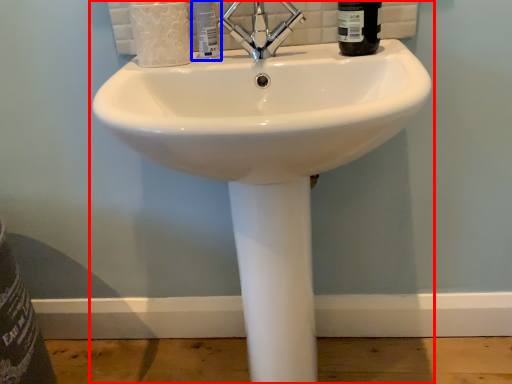
Question: Which object is closer to the camera taking this photo, sink (highlighted by a red box) or toiletry (highlighted by a blue box)?

Choices:
 (A) sink
 (B) toiletry

Answer: (A)